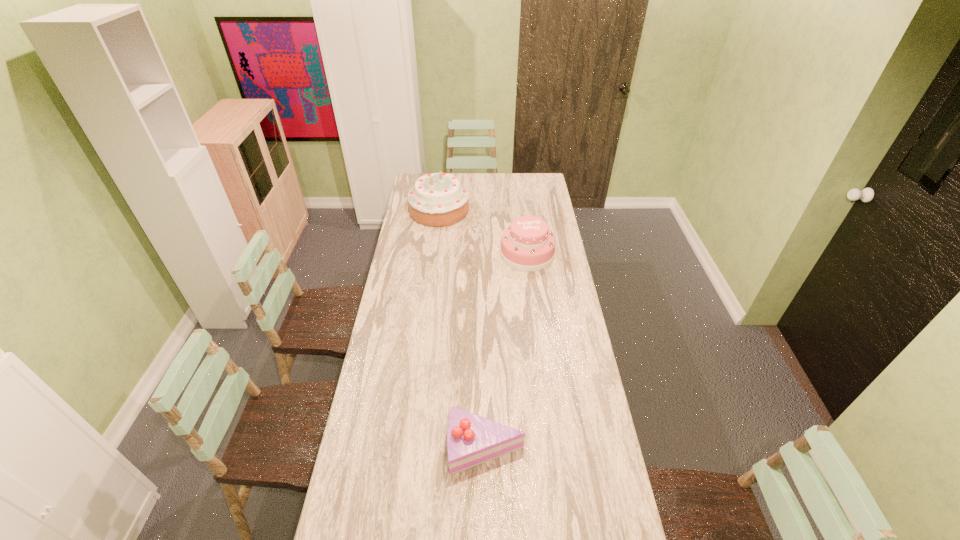
At what (x,y) coordinates should I click in order to perform the action: click on the farthest cake. Please return your answer as a coordinate pair (x, y). This screenshot has height=540, width=960. Looking at the image, I should click on (439, 199).

You are a GUI agent. You are given a task and a screenshot of the screen. Output one action in this format:
    pyautogui.click(x=<x>, y=<y>)
    Task: Click on the tallest object
    The image size is (960, 540).
    Given the screenshot: What is the action you would take?
    pyautogui.click(x=439, y=199)

Where is `the second tallest object`? This screenshot has height=540, width=960. the second tallest object is located at coordinates (527, 245).

Image resolution: width=960 pixels, height=540 pixels. Identify the location of the second nearest cake. (527, 245).

What are the coordinates of `the nearest object` in the screenshot? It's located at (472, 440).

The height and width of the screenshot is (540, 960). I want to click on the nearest cake, so click(472, 440).

Identify the location of free space located 0.240m on the front of the tallest cake. (434, 256).

The width and height of the screenshot is (960, 540). What are the coordinates of `vacant point located on the front of the second tallest object` in the screenshot? It's located at (533, 300).

The width and height of the screenshot is (960, 540). Identify the location of vacant space situated on the front of the nearest cake. (487, 524).

The height and width of the screenshot is (540, 960). I want to click on object at the left edge, so click(x=439, y=199).